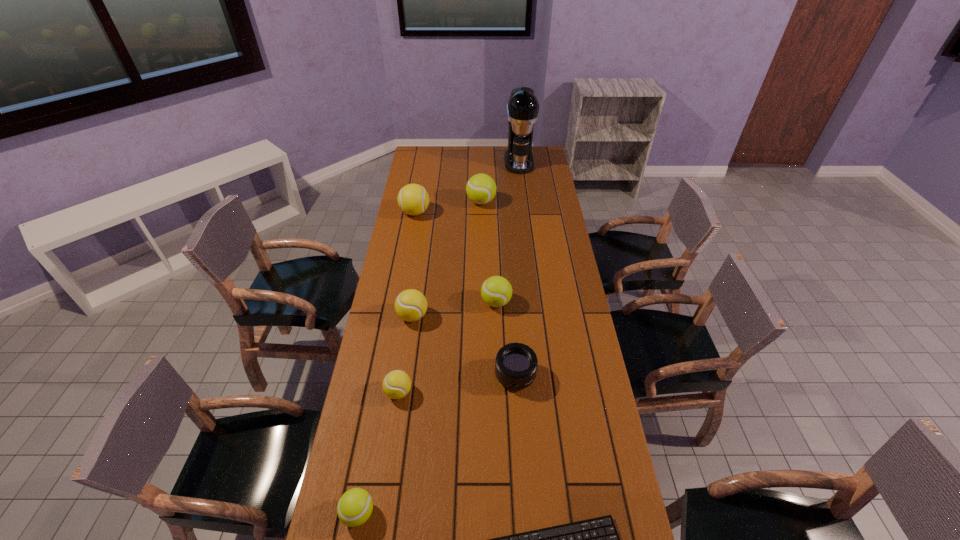
This screenshot has width=960, height=540. Find the location of `vacant area that lies between the farthest object and the nearest tennis ball`. vacant area that lies between the farthest object and the nearest tennis ball is located at coordinates (439, 338).

The image size is (960, 540). Identify the location of vacant point located between the second biggest yellow tennis ball and the smallest green tennis ball. (386, 415).

The height and width of the screenshot is (540, 960). In order to click on free spot between the farthest green tennis ball and the second farthest yellow tennis ball in this screenshot , I will do `click(447, 259)`.

Locate an element on the screen. The height and width of the screenshot is (540, 960). free spot between the coffee maker and the second smallest yellow tennis ball is located at coordinates click(466, 239).

Select which object is the seventh closest to the farthest yellow tennis ball. Please provide its 2D coordinates. Your answer should be formatted as a tuple, i.e. [(x, y)], where the tuple contains the x and y coordinates of a point satisfying the conditions above.

[(354, 508)]

In order to click on object that is the sixth closest one to the second smallest green tennis ball in this screenshot , I will do `click(596, 539)`.

This screenshot has height=540, width=960. I want to click on the closest tennis ball relative to the smallest yellow tennis ball, so click(x=410, y=305).

Identify which tennis ball is the third closest to the biggest yellow tennis ball. Please provide its 2D coordinates. Your answer should be formatted as a tuple, i.e. [(x, y)], where the tuple contains the x and y coordinates of a point satisfying the conditions above.

[(410, 305)]

The image size is (960, 540). I want to click on green tennis ball that is the closest to the shortest object, so click(x=354, y=508).

Identify the location of green tennis ball that stands as the closest to the leftmost green tennis ball. pos(496,291).